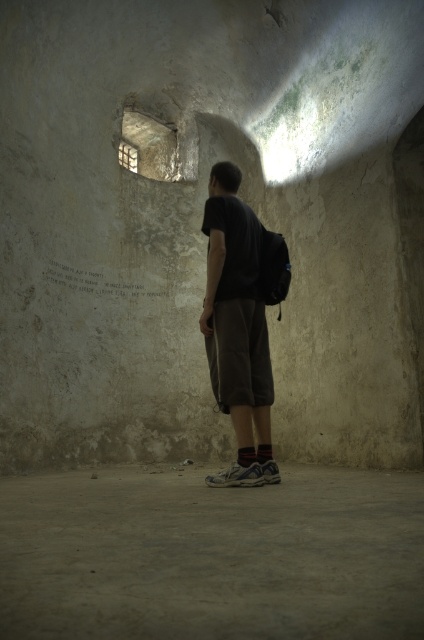
Can you confirm if smooth concrete floor at lower center is thinner than white paper at center?

No, smooth concrete floor at lower center is not thinner than white paper at center.

Find the location of a particular element. This screenshot has height=640, width=424. smooth concrete floor at lower center is located at coordinates [x=212, y=556].

Who is more forward, (x=41, y=618) or (x=220, y=268)?

Positioned in front is point (x=41, y=618).

Is point (222, 563) farther from camera compared to point (239, 337)?

No, (222, 563) is in front of (239, 337).

Is point (181, 621) more distant than point (226, 173)?

No, it is in front of (226, 173).

Identify the location of smooth concrete floor at lower center. Image resolution: width=424 pixels, height=640 pixels. (212, 556).

Which is more to the right, dark gray cotton t-shirt at center or white paper at center?

dark gray cotton t-shirt at center is more to the right.

Which is below, dark gray cotton t-shirt at center or white paper at center?

dark gray cotton t-shirt at center is below.

Measure the distance between dark gray cotton t-shirt at center and camera.

They are 3.53 meters apart.

Find the location of a particular element. dark gray cotton t-shirt at center is located at coordinates (240, 323).